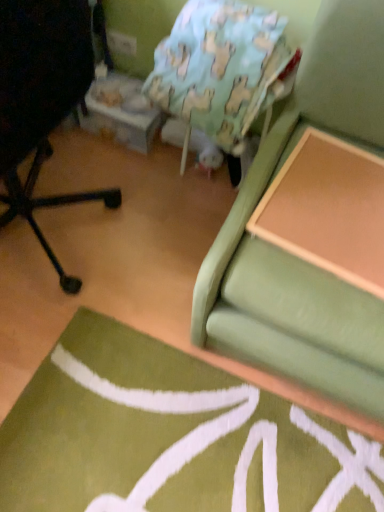
Identify the location of wooden table at upper right. The width and height of the screenshot is (384, 512). (328, 209).

In order to face green fabric studio couch at upper right, should I rotate leftwards or rightwards?

To face it directly, rotate right by 21.922 degrees.

The image size is (384, 512). Identify the location of light blue fabric bean bag chair at upper center. (222, 70).

This screenshot has height=512, width=384. What are the coordinates of `black matte chair at left` in the screenshot? It's located at (42, 100).

Where is `wooden table at upper right`? wooden table at upper right is located at coordinates (328, 209).

Is light blue fabric bean bag chair at upper center located within green fabric studio couch at upper right?

No.

The height and width of the screenshot is (512, 384). I want to click on studio couch below the light blue fabric bean bag chair at upper center (from a real-world perspective), so click(x=296, y=256).

From the image's perspective, is green fabric studio couch at upper right on light blue fabric bean bag chair at upper center?

Actually, green fabric studio couch at upper right appears below light blue fabric bean bag chair at upper center in the image.

In the scene shown: Considering the positions of objects green fabric studio couch at upper right and light blue fabric bean bag chair at upper center in the image provided, who is more to the right, green fabric studio couch at upper right or light blue fabric bean bag chair at upper center?

green fabric studio couch at upper right.

Is wooden table at upper right turned away from black matte chair at left?

No, black matte chair at left is not at the back of wooden table at upper right.

Is wooden table at upper right beside black matte chair at left?

wooden table at upper right is not next to black matte chair at left, and they're not touching.

Would you say wooden table at upper right is to the left or to the right of black matte chair at left in the picture?

In the image, wooden table at upper right appears on the right side of black matte chair at left.

Is black matte chair at left at the left side of green fabric studio couch at upper right?

Yes, black matte chair at left is to the left of green fabric studio couch at upper right.

Does point (109, 203) come behind point (225, 343)?

Yes.

Is green fabric studio couch at upper right a part of black matte chair at left?

That's incorrect, green fabric studio couch at upper right is not inside black matte chair at left.

Would you say black matte chair at left is a long distance from green fabric studio couch at upper right?

They are positioned close to each other.

Which of these two, green fabric studio couch at upper right or wooden table at upper right, stands shorter?

wooden table at upper right is shorter.

Does green fabric studio couch at upper right have a smaller size compared to wooden table at upper right?

No, green fabric studio couch at upper right is not smaller than wooden table at upper right.

Could you tell me if green fabric studio couch at upper right is turned towards wooden table at upper right?

Yes, green fabric studio couch at upper right faces towards wooden table at upper right.

In the scene shown: Is green fabric studio couch at upper right not inside wooden table at upper right?

That's correct, green fabric studio couch at upper right is outside of wooden table at upper right.

Between wooden table at upper right and green fabric studio couch at upper right, which one has larger size?

green fabric studio couch at upper right.

From a real-world perspective, is wooden table at upper right above or below green fabric studio couch at upper right?

wooden table at upper right is situated higher than green fabric studio couch at upper right in the real world.

The width and height of the screenshot is (384, 512). Identify the location of studio couch located on the right of wooden table at upper right. tap(296, 256).

Is point (361, 244) farther from camera compared to point (285, 23)?

No, (361, 244) is closer to viewer.

Considering the relative sizes of wooden table at upper right and light blue fabric bean bag chair at upper center in the image provided, is wooden table at upper right wider than light blue fabric bean bag chair at upper center?

Indeed, wooden table at upper right has a greater width compared to light blue fabric bean bag chair at upper center.

Consider the image. Considering their positions, is wooden table at upper right located in front of or behind light blue fabric bean bag chair at upper center?

Clearly, wooden table at upper right is in front of light blue fabric bean bag chair at upper center.

Can you confirm if wooden table at upper right is bigger than light blue fabric bean bag chair at upper center?

No, wooden table at upper right is not bigger than light blue fabric bean bag chair at upper center.

Is wooden table at upper right located within black matte chair at left?

That's incorrect, wooden table at upper right is not inside black matte chair at left.

At what (x,y) coordinates should I click in order to perform the action: click on chair that appears above the wooden table at upper right (from a real-world perspective). Please return your answer as a coordinate pair (x, y). This screenshot has width=384, height=512. Looking at the image, I should click on (42, 100).

Can you confirm if black matte chair at left is positioned to the right of wooden table at upper right?

No, black matte chair at left is not to the right of wooden table at upper right.

Between black matte chair at left and wooden table at upper right, which one has smaller size?

With smaller size is wooden table at upper right.

Where is `bean bag chair that appears on the left of green fabric studio couch at upper right`? bean bag chair that appears on the left of green fabric studio couch at upper right is located at coordinates (222, 70).

I want to click on table below the black matte chair at left (from a real-world perspective), so click(x=328, y=209).

Which object lies nearer to the anchor point black matte chair at left, light blue fabric bean bag chair at upper center or wooden table at upper right?

light blue fabric bean bag chair at upper center is positioned closer to the anchor black matte chair at left.

When comparing their distances from black matte chair at left, does wooden table at upper right or light blue fabric bean bag chair at upper center seem closer?

The object closer to black matte chair at left is light blue fabric bean bag chair at upper center.

Based on their spatial positions, is wooden table at upper right or light blue fabric bean bag chair at upper center closer to green fabric studio couch at upper right?

wooden table at upper right lies closer to green fabric studio couch at upper right than the other object.

When comparing their distances from light blue fabric bean bag chair at upper center, does green fabric studio couch at upper right or wooden table at upper right seem closer?

Among the two, green fabric studio couch at upper right is located nearer to light blue fabric bean bag chair at upper center.

Estimate the real-world distances between objects in this image. Which object is further from black matte chair at left, green fabric studio couch at upper right or wooden table at upper right?

The object further to black matte chair at left is wooden table at upper right.

Looking at the image, which one is located closer to wooden table at upper right, green fabric studio couch at upper right or black matte chair at left?

green fabric studio couch at upper right is positioned closer to the anchor wooden table at upper right.

Based on their spatial positions, is green fabric studio couch at upper right or black matte chair at left closer to light blue fabric bean bag chair at upper center?

green fabric studio couch at upper right lies closer to light blue fabric bean bag chair at upper center than the other object.

Which object lies nearer to the anchor point green fabric studio couch at upper right, black matte chair at left or light blue fabric bean bag chair at upper center?

light blue fabric bean bag chair at upper center is closer to green fabric studio couch at upper right.

Find the location of a particular element. The height and width of the screenshot is (512, 384). bean bag chair situated between black matte chair at left and green fabric studio couch at upper right from left to right is located at coordinates (222, 70).

Where is `table positioned between green fabric studio couch at upper right and light blue fabric bean bag chair at upper center from near to far`? The image size is (384, 512). table positioned between green fabric studio couch at upper right and light blue fabric bean bag chair at upper center from near to far is located at coordinates (328, 209).

Locate an element on the screen. The height and width of the screenshot is (512, 384). bean bag chair between black matte chair at left and wooden table at upper right in the horizontal direction is located at coordinates (222, 70).

At what (x,y) coordinates should I click in order to perform the action: click on table located between black matte chair at left and green fabric studio couch at upper right in the left-right direction. Please return your answer as a coordinate pair (x, y). Looking at the image, I should click on (328, 209).